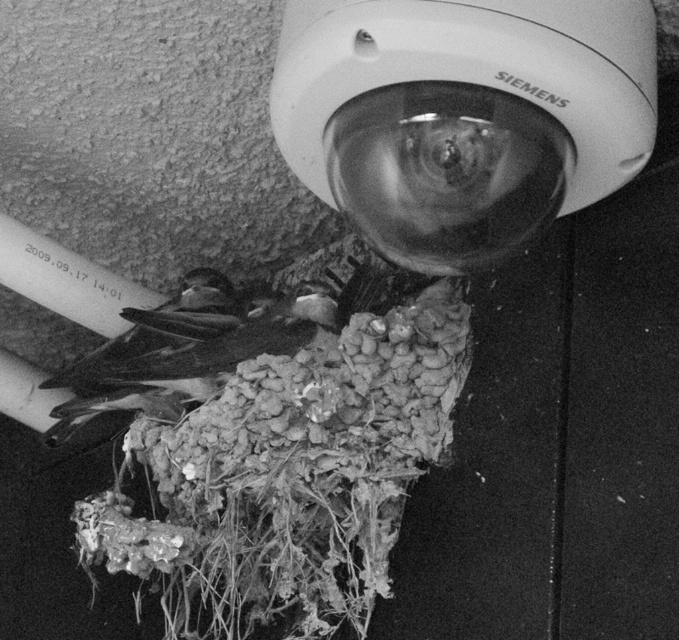
You are a wildlife photographer who just took a photo of a nest and feathers. In the image, you see the fuzzy organic nest at lower center and the dark brown feathers at center. Which object is located to the left of the other?

The dark brown feathers at center are to the left of the fuzzy organic nest at lower center because the fuzzy organic nest at lower center is positioned on the right side of dark brown feathers at center.

You are a photographer analyzing the composition of this black and white photo. The image has a Siemens security camera mounted on a wall. There is also a fuzzy organic nest at lower center. Based on their positions, can you determine if the nest is directly beneath the camera?

The fuzzy organic nest at lower center is located at point (289, 476), so yes, it is directly beneath the Siemens security camera mounted on the wall.